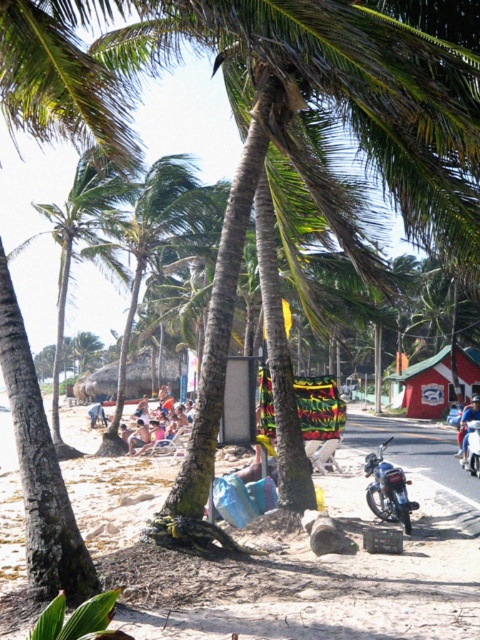
Is point (391, 500) positioned in front of point (163, 426)?

Yes.

Between shiny chrome motorcycle at lower right and beige fabric chair at center, which one appears on the right side from the viewer's perspective?

shiny chrome motorcycle at lower right is more to the right.

Between point (371, 492) and point (187, 422), which one is positioned in front?

Point (371, 492) is more forward.

You are a GUI agent. You are given a task and a screenshot of the screen. Output one action in this format:
    pyautogui.click(x=<x>, y=<y>)
    Task: Click on the shiny chrome motorcycle at lower right
    
    Given the screenshot: What is the action you would take?
    pyautogui.click(x=387, y=490)

Which of these two, beach sand at lower left or shiny chrome motorcycle at lower right, stands taller?

Standing taller between the two is beach sand at lower left.

Does beach sand at lower left have a greater height compared to shiny chrome motorcycle at lower right?

Indeed, beach sand at lower left has a greater height compared to shiny chrome motorcycle at lower right.

Between point (63, 472) and point (383, 470), which one is positioned behind?

The point (63, 472) is more distant.

The height and width of the screenshot is (640, 480). Identify the location of beach sand at lower left. (291, 556).

Is beach sand at lower left shorter than beige fabric chair at center?

No.

Does point (395, 604) come closer to viewer compared to point (168, 419)?

That is True.

This screenshot has height=640, width=480. I want to click on beach sand at lower left, so click(x=291, y=556).